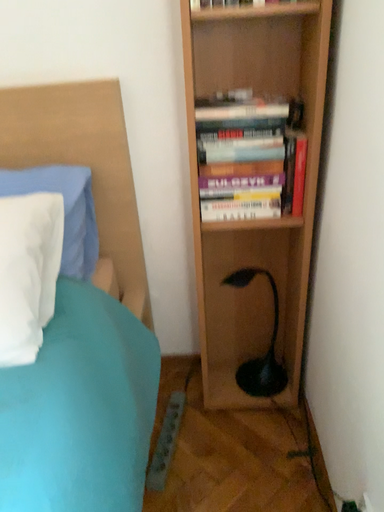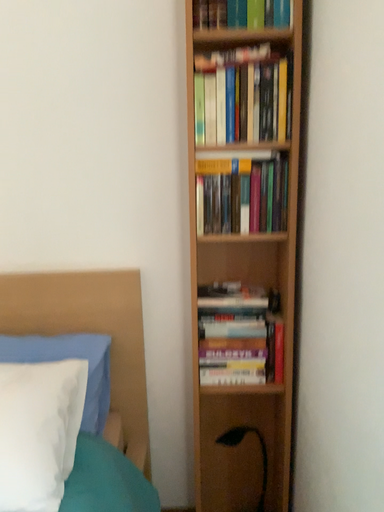
Question: Which way did the camera rotate in the video?

Choices:
 (A) rotated downward
 (B) rotated upward

Answer: (B)